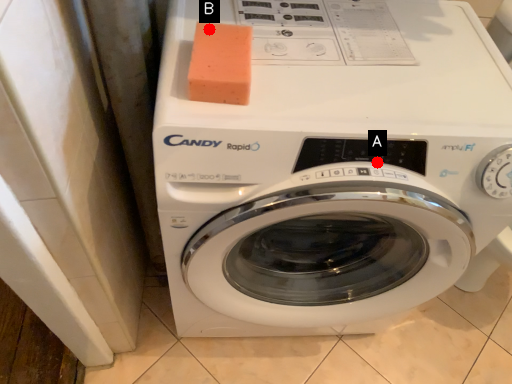
Question: Two points are circled on the image, labeled by A and B beside each circle. Which of the following is the closest to the observer?

Choices:
 (A) A is closer
 (B) B is closer

Answer: (A)